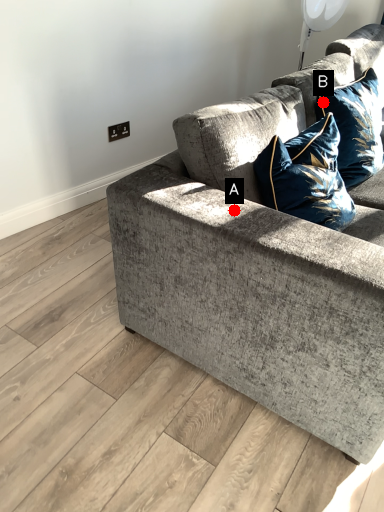
Question: Two points are circled on the image, labeled by A and B beside each circle. Among these points, which one is farthest from the camera?

Choices:
 (A) A is further
 (B) B is further

Answer: (B)